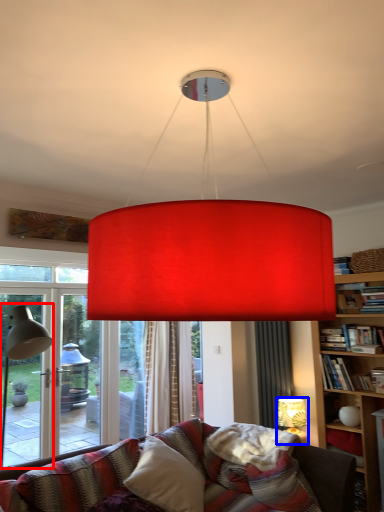
Question: Which object is closer to the camera taking this photo, table lamp (highlighted by a red box) or lamp (highlighted by a blue box)?

Choices:
 (A) table lamp
 (B) lamp

Answer: (A)